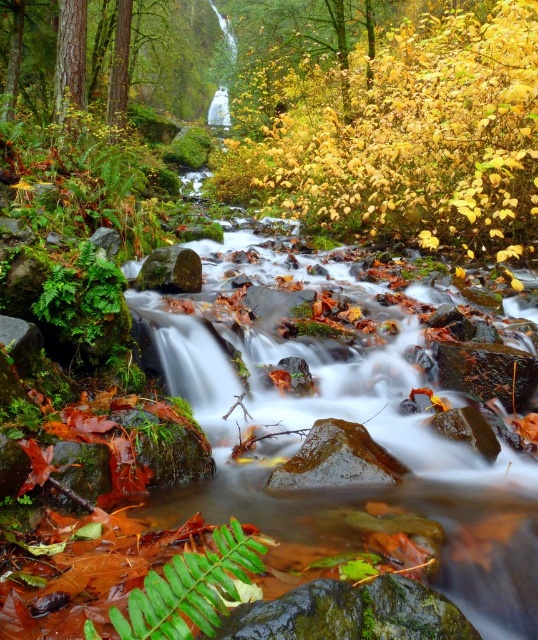
Which is behind, point (110, 54) or point (196, 614)?

The point (110, 54) is behind.

Who is higher up, smooth bark tree at upper left or green matte fern at lower left?

smooth bark tree at upper left

What are the coordinates of `smooth bark tree at upper left` in the screenshot? It's located at coord(27,54).

Where is `smooth bark tree at upper left`? smooth bark tree at upper left is located at coordinates (27, 54).

Can you confirm if smooth bark tree at upper left is positioned to the left of green mossy rock at center?

Indeed, smooth bark tree at upper left is positioned on the left side of green mossy rock at center.

Between smooth bark tree at upper left and green mossy rock at center, which one has more height?

Standing taller between the two is smooth bark tree at upper left.

Does point (58, 13) lie in front of point (181, 248)?

That is False.

The height and width of the screenshot is (640, 538). In order to click on smooth bark tree at upper left in this screenshot , I will do coord(27,54).

Is green matte fern at lower left positioned at the back of green mossy rock at center?

No, it is in front of green mossy rock at center.

Which of these two, green matte fern at lower left or green mossy rock at center, stands taller?

With more height is green mossy rock at center.

Describe the element at coordinates (190, 588) in the screenshot. This screenshot has height=640, width=538. I see `green matte fern at lower left` at that location.

At what (x,y) coordinates should I click in order to perform the action: click on green matte fern at lower left. Please return your answer as a coordinate pair (x, y). This screenshot has width=538, height=640. Looking at the image, I should click on (190, 588).